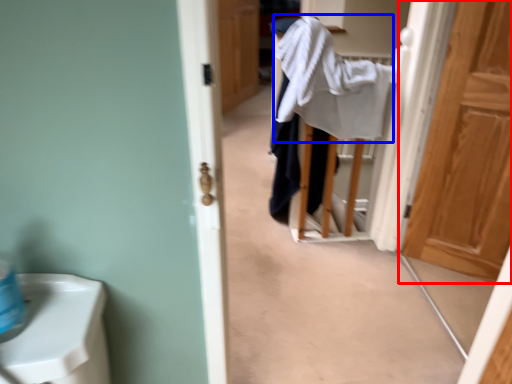
Question: Among these objects, which one is farthest to the camera, door (highlighted by a red box) or bath towel (highlighted by a blue box)?

Choices:
 (A) door
 (B) bath towel

Answer: (B)